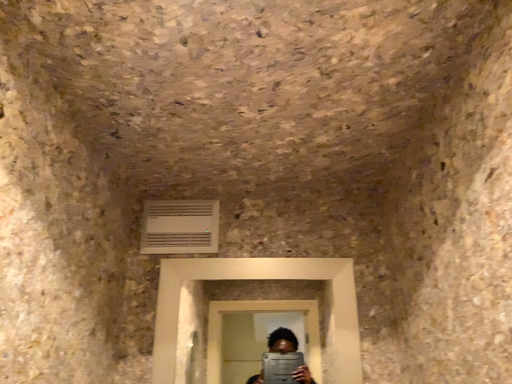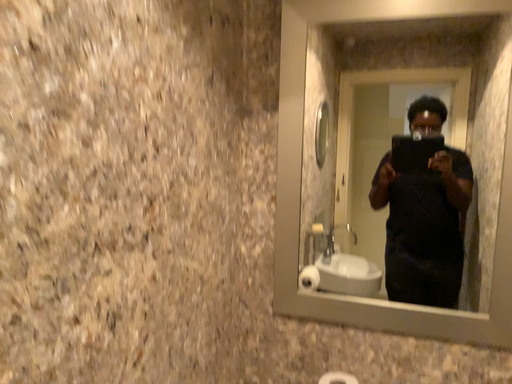
Question: Which way did the camera rotate in the video?

Choices:
 (A) rotated right
 (B) rotated left

Answer: (B)